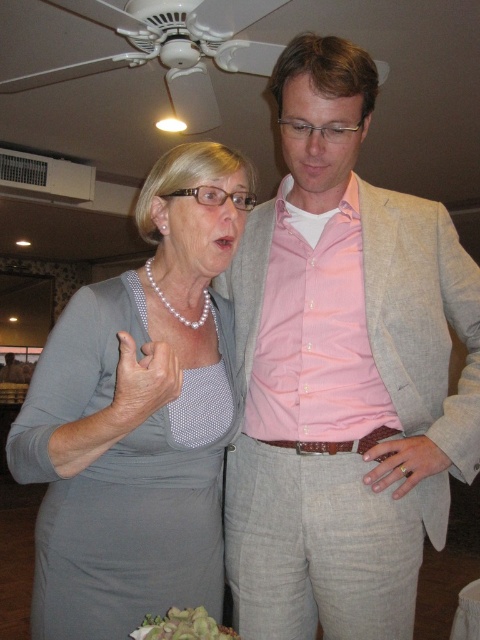
Question: Which object is farther from the camera taking this photo?

Choices:
 (A) pearl necklace at center
 (B) green leafy salad at lower center

Answer: (A)

Question: Can you confirm if pink linen suit at center is positioned to the left of pearl necklace at center?

Choices:
 (A) no
 (B) yes

Answer: (A)

Question: Which object is positioned closest to the pink linen suit at center?

Choices:
 (A) green leafy salad at lower center
 (B) pearl necklace at center

Answer: (B)

Question: Does pink linen suit at center lie in front of green leafy salad at lower center?

Choices:
 (A) yes
 (B) no

Answer: (B)

Question: Which point is farther from the camera taking this photo?

Choices:
 (A) (216, 636)
 (B) (242, 161)
 (C) (226, 276)

Answer: (C)

Question: Does pearl necklace at center have a greater width compared to green leafy salad at lower center?

Choices:
 (A) yes
 (B) no

Answer: (A)